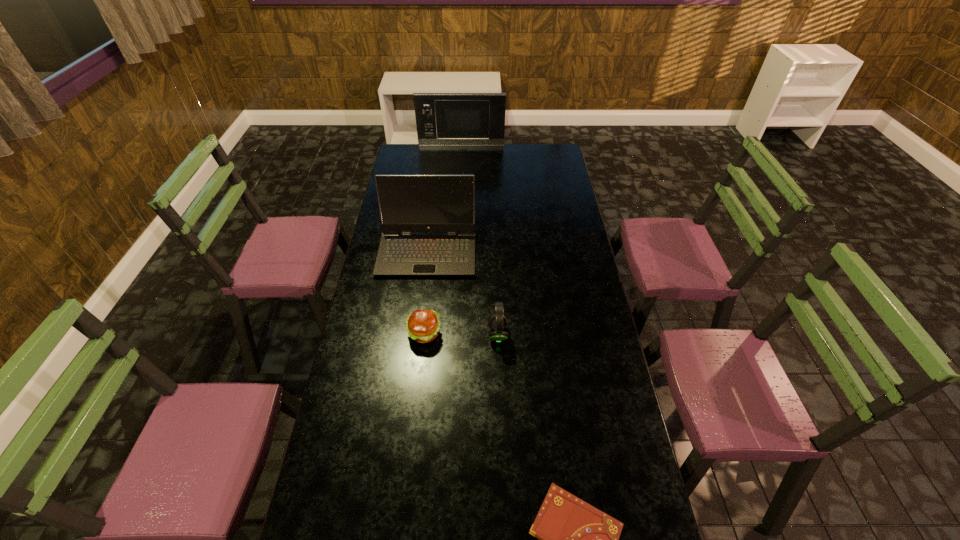
Identify the location of object located at the far edge. Image resolution: width=960 pixels, height=540 pixels. (441, 118).

Identify the location of microwave oven located in the left edge section of the desktop. The image size is (960, 540). (441, 118).

In order to click on laptop computer that is at the left edge in this screenshot , I will do `click(408, 203)`.

The width and height of the screenshot is (960, 540). What are the coordinates of `object that is positioned at the far left corner` in the screenshot? It's located at (441, 118).

In the image, there is a desktop. Where is `vacant space at the far edge`? The width and height of the screenshot is (960, 540). vacant space at the far edge is located at coordinates coord(431,161).

At what (x,y) coordinates should I click in order to perform the action: click on vacant space at the left edge of the desktop. Please return your answer as a coordinate pair (x, y). This screenshot has height=540, width=960. Looking at the image, I should click on (387, 291).

You are a GUI agent. You are given a task and a screenshot of the screen. Output one action in this format:
    pyautogui.click(x=<x>, y=<y>)
    Task: Click on the vacant point at the right edge
    This screenshot has height=540, width=960.
    Given the screenshot: What is the action you would take?
    pyautogui.click(x=591, y=294)

Locate an element on the screen. Image resolution: width=960 pixels, height=540 pixels. free space between the second shortest object and the third tallest object is located at coordinates (461, 334).

Choose which object is the nearest neighbor to the fourth tallest object. Please provide its 2D coordinates. Your answer should be formatted as a tuple, i.e. [(x, y)], where the tuple contains the x and y coordinates of a point satisfying the conditions above.

[(498, 322)]

Locate which object is the fourth closest to the third shortest object. Please provide its 2D coordinates. Your answer should be formatted as a tuple, i.e. [(x, y)], where the tuple contains the x and y coordinates of a point satisfying the conditions above.

[(441, 118)]